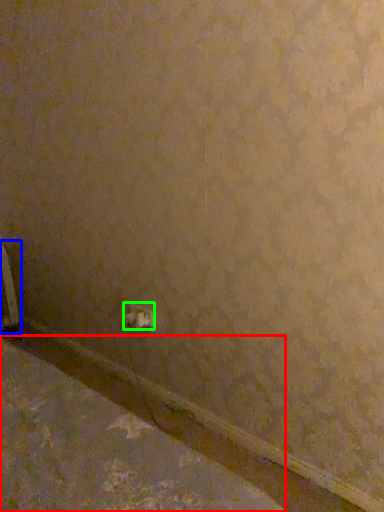
Question: Which object is positioned farthest from concrete (highlighted by a red box)? Select from radiator (highlighted by a blue box) and power plugs and sockets (highlighted by a green box).

Choices:
 (A) radiator
 (B) power plugs and sockets

Answer: (A)